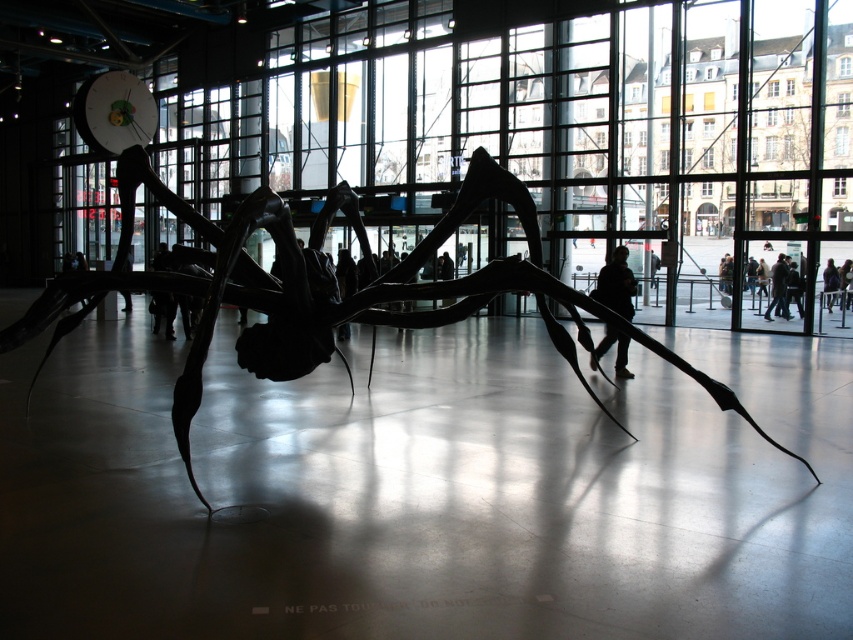
You are an architect designing a new lighting system for the space. You need to place a spotlight at point (x=329, y=300). According to the image, what object is located at that coordinate?

The point (x=329, y=300) marks the location of the black matte spider at center.

Based on the photo, you are standing in the modern building and want to take a photo of the black matte spider at center without the dark blue jeans at lower right appearing in the frame. Which direction should you move to achieve this?

Move to the right side of the black matte spider at center since it is to the left of the dark blue jeans at lower right, so moving right would place the spider away from the jeans.